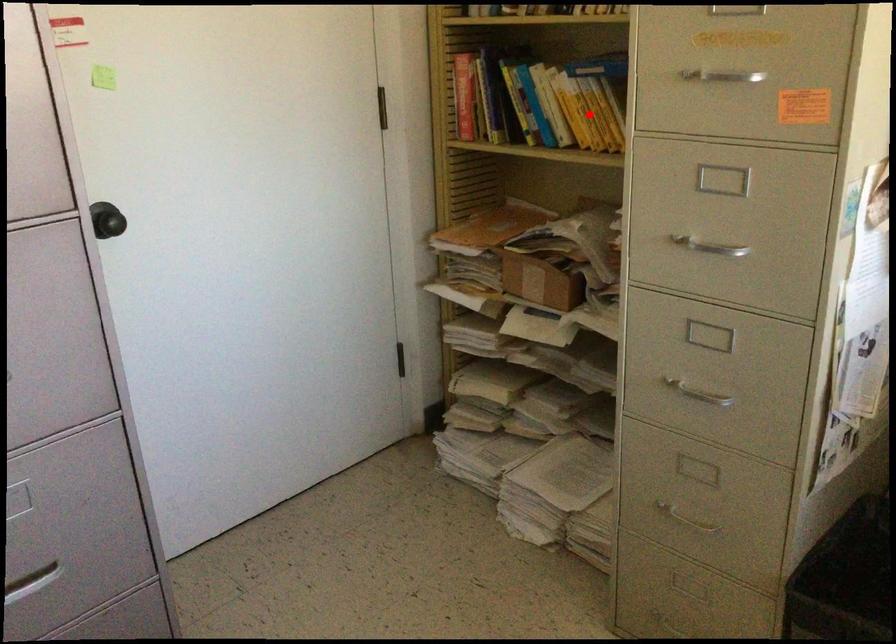
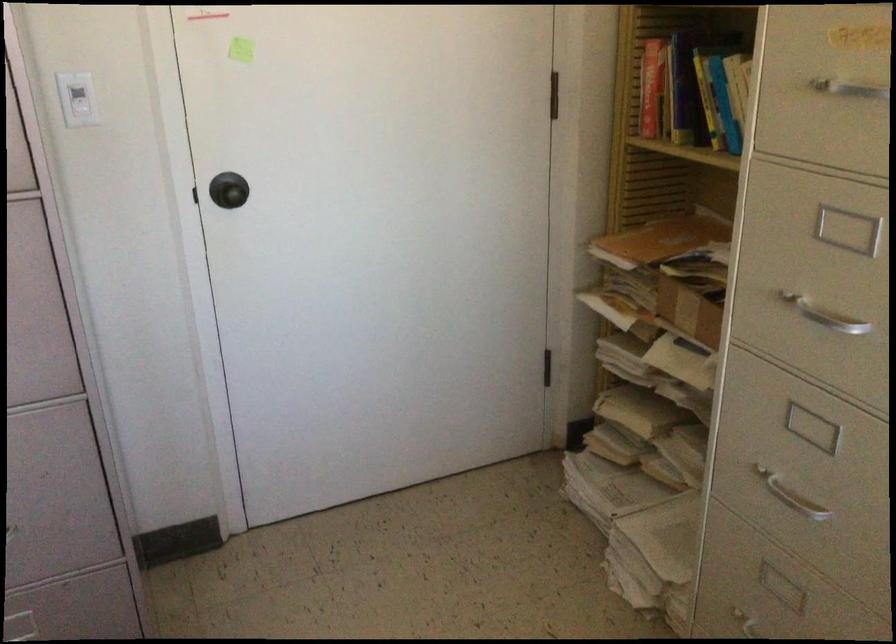
Question: I am providing you with two images of the same scene from different viewpoints. A red point is marked on the first image. Can you still see the location of the red point in image 2?

Choices:
 (A) Yes
 (B) No

Answer: (B)